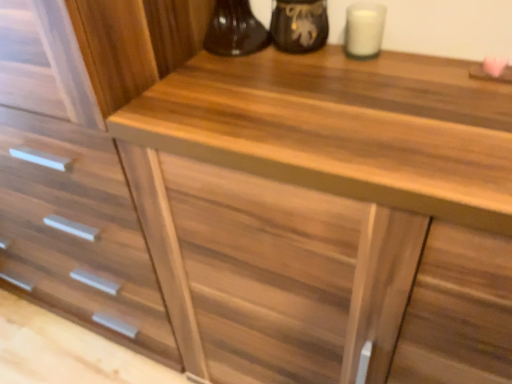
Question: From the image's perspective, is wooden drawer at center beneath matte black vase at upper center?

Choices:
 (A) no
 (B) yes

Answer: (B)

Question: Is wooden drawer at center at the right side of matte black vase at upper center?

Choices:
 (A) yes
 (B) no

Answer: (B)

Question: Does wooden drawer at center lie behind matte black vase at upper center?

Choices:
 (A) no
 (B) yes

Answer: (A)

Question: Could you tell me if wooden drawer at center is turned towards matte black vase at upper center?

Choices:
 (A) no
 (B) yes

Answer: (A)

Question: Is the depth of wooden drawer at center less than that of matte black vase at upper center?

Choices:
 (A) yes
 (B) no

Answer: (A)

Question: Is matte black vase at upper center at the back of wooden drawer at center?

Choices:
 (A) no
 (B) yes

Answer: (A)

Question: Is white matte candle at upper right oriented towards wooden drawer at center?

Choices:
 (A) no
 (B) yes

Answer: (A)

Question: From a real-world perspective, is white matte candle at upper right positioned under wooden drawer at center based on gravity?

Choices:
 (A) no
 (B) yes

Answer: (A)

Question: Considering the relative positions of white matte candle at upper right and wooden drawer at center in the image provided, is white matte candle at upper right behind wooden drawer at center?

Choices:
 (A) yes
 (B) no

Answer: (A)

Question: Is white matte candle at upper right thinner than wooden drawer at center?

Choices:
 (A) yes
 (B) no

Answer: (A)

Question: Is white matte candle at upper right facing away from wooden drawer at center?

Choices:
 (A) yes
 (B) no

Answer: (B)

Question: Is wooden drawer at center located within white matte candle at upper right?

Choices:
 (A) no
 (B) yes

Answer: (A)

Question: Is the position of white matte candle at upper right more distant than that of matte black vase at upper center?

Choices:
 (A) no
 (B) yes

Answer: (A)